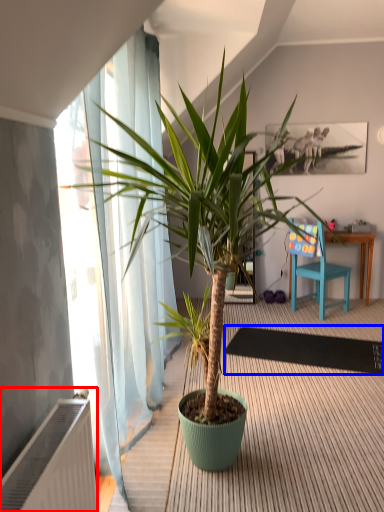
Question: Among these objects, which one is nearest to the camera, radiator (highlighted by a red box) or mat (highlighted by a blue box)?

Choices:
 (A) radiator
 (B) mat

Answer: (A)